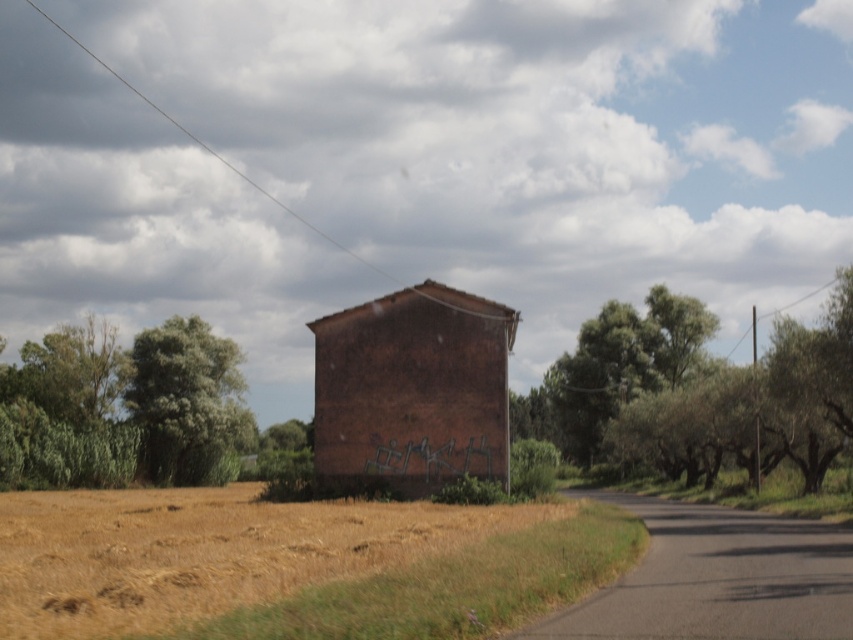
Does point (582, 458) come behind point (206, 442)?

Yes.

Does green leafy tree at upper right have a lesser width compared to green leafy tree at left?

No.

This screenshot has width=853, height=640. Describe the element at coordinates (618, 368) in the screenshot. I see `green leafy tree at upper right` at that location.

Identify the location of green leafy tree at upper right. The width and height of the screenshot is (853, 640). (618, 368).

I want to click on green leafy tree at right, so click(x=698, y=400).

Is point (815, 472) in front of point (573, 365)?

Yes, it is.

Is point (602, 461) farther from camera compared to point (553, 428)?

No, it is not.

The width and height of the screenshot is (853, 640). Find the location of `green leafy tree at right`. green leafy tree at right is located at coordinates (698, 400).

Can you confirm if green leafy tree at right is smaller than green leafy tree at left?

Actually, green leafy tree at right might be larger than green leafy tree at left.

Which is in front, point (610, 452) or point (177, 385)?

Point (177, 385) is in front.

Describe the element at coordinates (698, 400) in the screenshot. I see `green leafy tree at right` at that location.

This screenshot has width=853, height=640. What are the coordinates of `green leafy tree at right` in the screenshot? It's located at (698, 400).